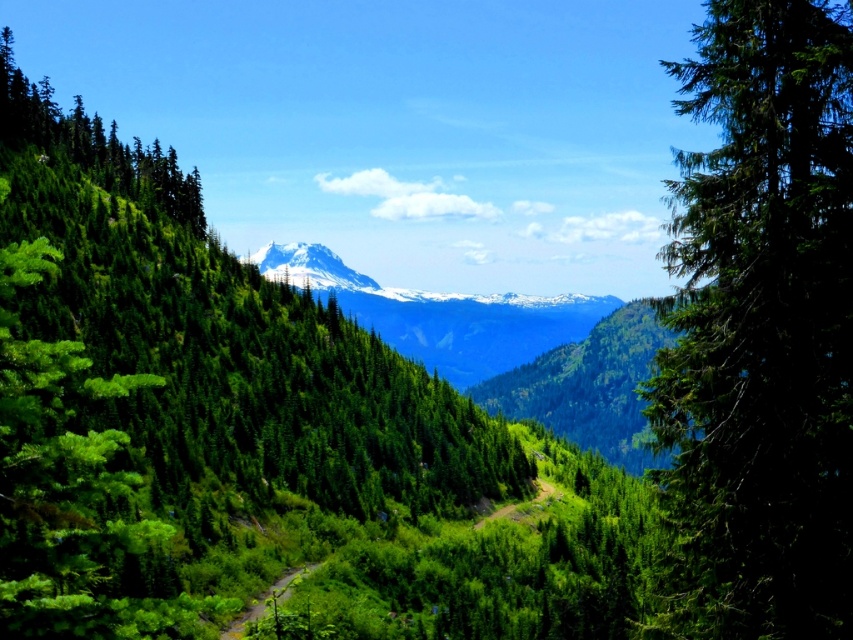
Question: Which is nearer to the snowy rocky mountain range at center?

Choices:
 (A) green glossy tree at left
 (B) green needle-like at right

Answer: (A)

Question: Does green glossy tree at left appear under snowy rocky mountain range at center?

Choices:
 (A) yes
 (B) no

Answer: (A)

Question: Can you confirm if green needle-like at right is thinner than snowy rocky mountain range at center?

Choices:
 (A) yes
 (B) no

Answer: (A)

Question: Does green needle-like at right come in front of snowy rocky mountain range at center?

Choices:
 (A) yes
 (B) no

Answer: (A)

Question: Estimate the real-world distances between objects in this image. Which object is closer to the snowy rocky mountain range at center?

Choices:
 (A) green needle-like at right
 (B) green glossy tree at left

Answer: (B)

Question: Which point appears closest to the camera in this image?

Choices:
 (A) (451, 342)
 (B) (730, 586)

Answer: (B)